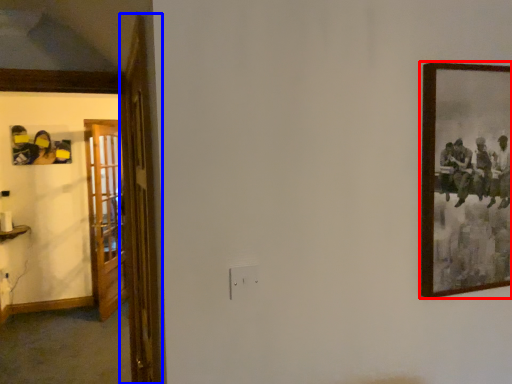
Question: Which object appears farthest to the camera in this image, picture frame (highlighted by a red box) or door (highlighted by a blue box)?

Choices:
 (A) picture frame
 (B) door

Answer: (A)